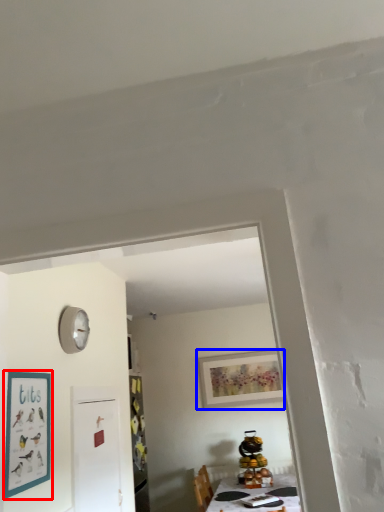
Question: Among these objects, which one is farthest to the camera, picture frame (highlighted by a red box) or picture frame (highlighted by a blue box)?

Choices:
 (A) picture frame
 (B) picture frame

Answer: (B)